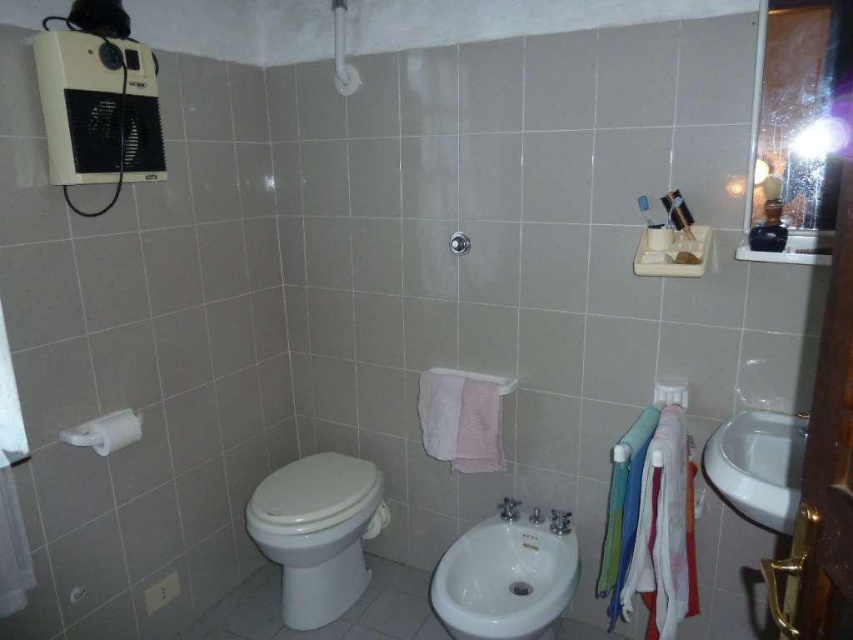
You are a delivery person who needs to place a new 20 inch wide package between the white glossy toilet at center and the white glossy bidet at center. Is there enough space for the package to fit between them?

The distance between the white glossy toilet at center and the white glossy bidet at center is 18.73 inches. Since the package is 20 inches wide, it is wider than the available space. Therefore, the package cannot fit between them.

You are a delivery person who needs to place a 30 inch wide package between the white glossy sink at right and the matte silver shower at upper center. Can the package fit in the space between them?

The distance between the white glossy sink at right and the matte silver shower at upper center is 36.41 inches. Since the package is 30 inches wide, it can fit in the space between them as there is enough room.